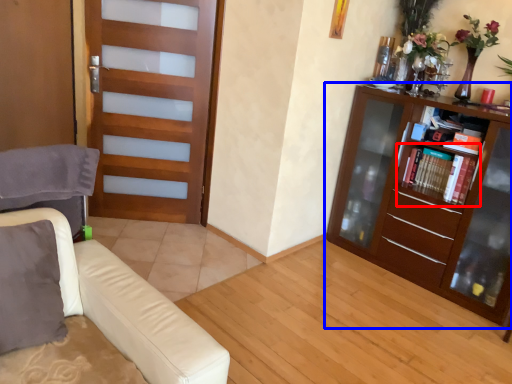
Question: Which of the following is the farthest to the observer, shelf (highlighted by a red box) or bookcase (highlighted by a blue box)?

Choices:
 (A) shelf
 (B) bookcase

Answer: (A)